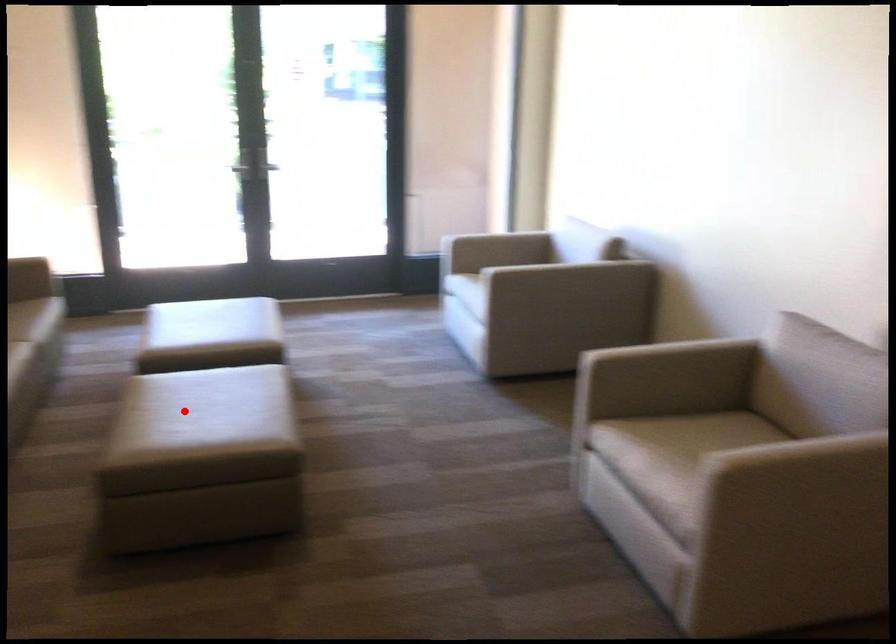
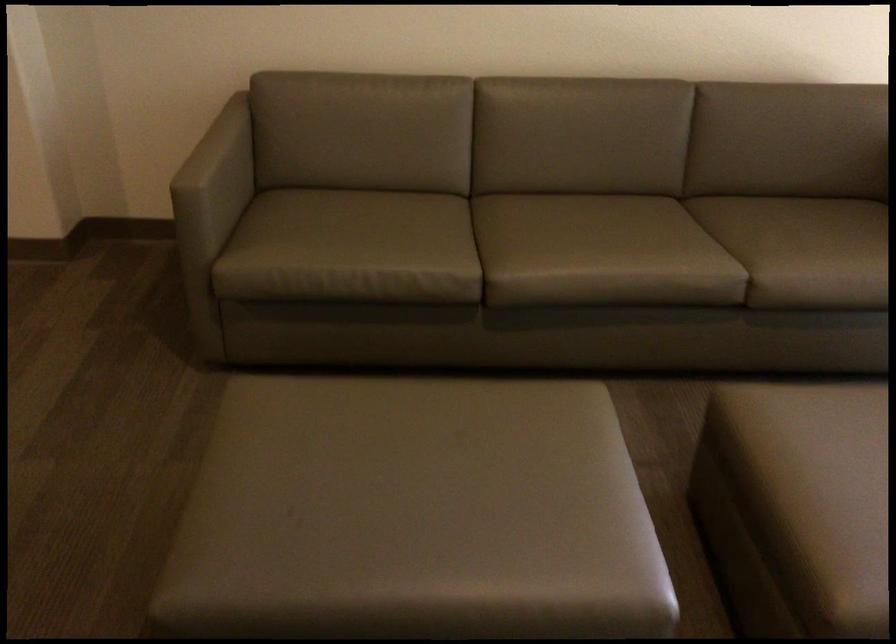
Locate, in the second image, the point that corresponds to the highlighted location in the first image.

(407, 480)